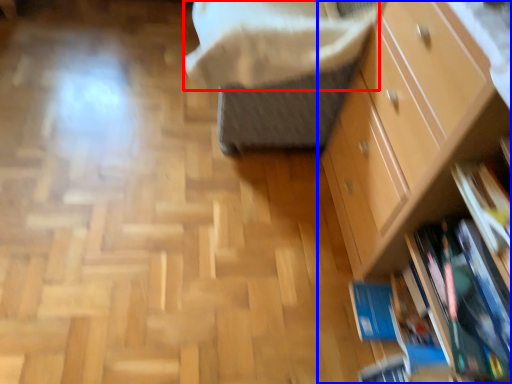
Question: Which point is closer to the camera, blanket (highlighted by a red box) or chest of drawers (highlighted by a blue box)?

Choices:
 (A) blanket
 (B) chest of drawers

Answer: (B)